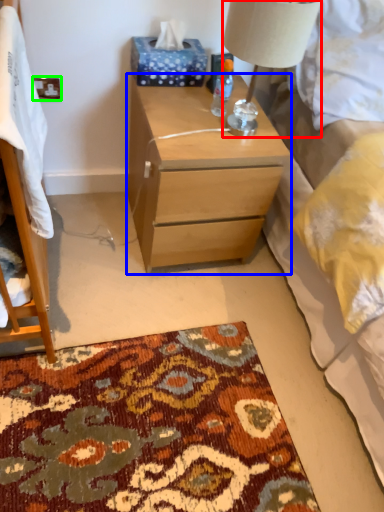
Question: Which object is positioned closest to lamp (highlighted by a red box)? Select from nightstand (highlighted by a blue box) and power outlet (highlighted by a green box).

Choices:
 (A) nightstand
 (B) power outlet

Answer: (A)